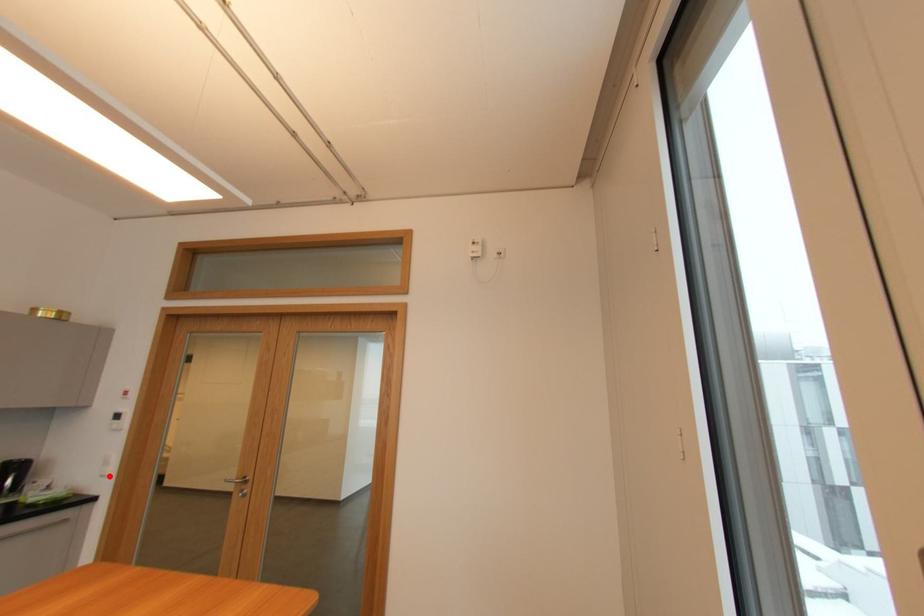
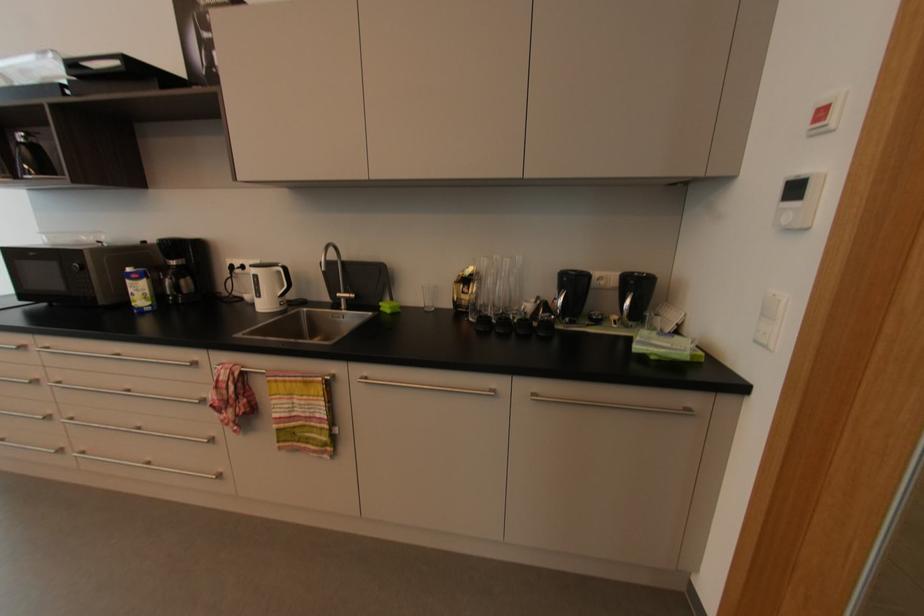
Question: I am providing you with two images of the same scene from different viewpoints. In image1, a red point is highlighted. Considering the same 3D point in image2, which of the following is correct?

Choices:
 (A) It is closer
 (B) It is farther

Answer: (B)